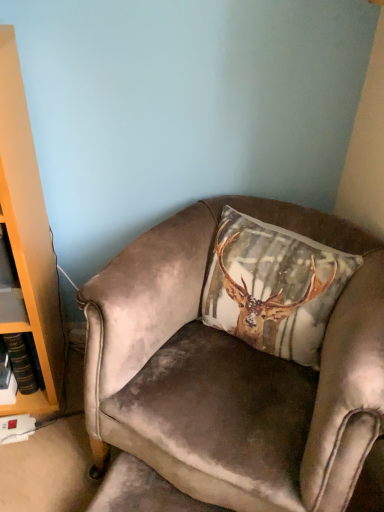
Find the location of a particular element. The image size is (384, 512). velvet brown armchair at center is located at coordinates (233, 371).

The height and width of the screenshot is (512, 384). Describe the element at coordinates (233, 371) in the screenshot. I see `velvet brown armchair at center` at that location.

Locate an element on the screen. The image size is (384, 512). velvet beige pillow with deer print at center is located at coordinates (273, 287).

Describe the element at coordinates (273, 287) in the screenshot. I see `velvet beige pillow with deer print at center` at that location.

Identify the location of velvet brown armchair at center. The height and width of the screenshot is (512, 384). [233, 371].

Considering the relative positions of velvet brown armchair at center and velvet beige pillow with deer print at center in the image provided, is velvet brown armchair at center to the left or to the right of velvet beige pillow with deer print at center?

velvet brown armchair at center is positioned on velvet beige pillow with deer print at center's left side.

Is velvet brown armchair at center positioned behind velvet beige pillow with deer print at center?

No, velvet brown armchair at center is closer to the viewer.

Is point (156, 264) in front of point (277, 263)?

Yes, point (156, 264) is closer to viewer.

From the picture: From the image's perspective, between velvet brown armchair at center and velvet beige pillow with deer print at center, which one is located above?

velvet beige pillow with deer print at center, from the image's perspective.

From a real-world perspective, is velvet brown armchair at center positioned above or below velvet beige pillow with deer print at center?

velvet brown armchair at center is below velvet beige pillow with deer print at center.

In terms of width, does velvet brown armchair at center look wider or thinner when compared to velvet beige pillow with deer print at center?

Clearly, velvet brown armchair at center has more width compared to velvet beige pillow with deer print at center.

Can you confirm if velvet brown armchair at center is shorter than velvet beige pillow with deer print at center?

No, velvet brown armchair at center is not shorter than velvet beige pillow with deer print at center.

Considering the sizes of objects velvet brown armchair at center and velvet beige pillow with deer print at center in the image provided, who is bigger, velvet brown armchair at center or velvet beige pillow with deer print at center?

velvet brown armchair at center.

From the picture: Do you think velvet brown armchair at center is within velvet beige pillow with deer print at center, or outside of it?

velvet brown armchair at center is not inside velvet beige pillow with deer print at center, it's outside.

Is velvet brown armchair at center touching velvet beige pillow with deer print at center?

velvet brown armchair at center is not next to velvet beige pillow with deer print at center, and they're not touching.

Could you tell me if velvet brown armchair at center is turned towards velvet beige pillow with deer print at center?

No, velvet brown armchair at center is not aimed at velvet beige pillow with deer print at center.

This screenshot has width=384, height=512. Identify the location of chair in front of the velvet beige pillow with deer print at center. (233, 371).

Which object is positioned more to the left, velvet beige pillow with deer print at center or velvet brown armchair at center?

From the viewer's perspective, velvet brown armchair at center appears more on the left side.

Between velvet beige pillow with deer print at center and velvet brown armchair at center, which one is positioned behind?

velvet beige pillow with deer print at center is more distant.

Which is in front, point (298, 315) or point (319, 471)?

The point (319, 471) is closer.

From the image's perspective, does velvet beige pillow with deer print at center appear higher than velvet brown armchair at center?

Yes, from the image's perspective, velvet beige pillow with deer print at center is above velvet brown armchair at center.

Consider the image. From a real-world perspective, which is physically above, velvet beige pillow with deer print at center or velvet brown armchair at center?

From a 3D spatial view, velvet beige pillow with deer print at center is above.

Is velvet beige pillow with deer print at center thinner than velvet brown armchair at center?

Indeed, velvet beige pillow with deer print at center has a lesser width compared to velvet brown armchair at center.

Can you confirm if velvet beige pillow with deer print at center is shorter than velvet brown armchair at center?

Correct, velvet beige pillow with deer print at center is not as tall as velvet brown armchair at center.

Consider the image. Considering the sizes of objects velvet beige pillow with deer print at center and velvet brown armchair at center in the image provided, who is smaller, velvet beige pillow with deer print at center or velvet brown armchair at center?

With smaller size is velvet beige pillow with deer print at center.

Can we say velvet beige pillow with deer print at center lies outside velvet brown armchair at center?

Actually, velvet beige pillow with deer print at center is within velvet brown armchair at center.

Is velvet beige pillow with deer print at center with velvet brown armchair at center?

No.

Is velvet beige pillow with deer print at center oriented away from velvet brown armchair at center?

That's right, velvet beige pillow with deer print at center is facing away from velvet brown armchair at center.

How many degrees apart are the facing directions of velvet beige pillow with deer print at center and velvet brown armchair at center?

The angle between the facing direction of velvet beige pillow with deer print at center and the facing direction of velvet brown armchair at center is 0.0952 degrees.

The height and width of the screenshot is (512, 384). In order to click on chair below the velvet beige pillow with deer print at center (from a real-world perspective) in this screenshot , I will do `click(233, 371)`.

You are a GUI agent. You are given a task and a screenshot of the screen. Output one action in this format:
    pyautogui.click(x=<x>, y=<y>)
    Task: Click on the pillow located above the velvet brown armchair at center (from a real-world perspective)
    The image size is (384, 512).
    Given the screenshot: What is the action you would take?
    pyautogui.click(x=273, y=287)

At what (x,y) coordinates should I click in order to perform the action: click on pillow that appears above the velvet brown armchair at center (from the image's perspective). Please return your answer as a coordinate pair (x, y). This screenshot has height=512, width=384. Looking at the image, I should click on (273, 287).